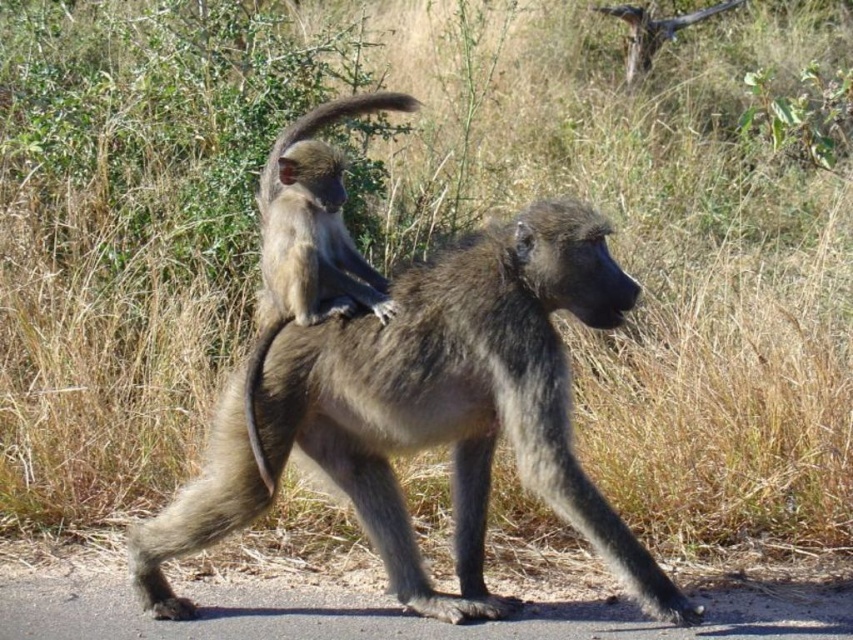
You are a wildlife photographer observing the two gray furry monkeys in the image. You want to capture a photo where the gray furry monkey at center is visible behind the gray furry monkey at upper center. Is this possible based on their positions?

Yes, the gray furry monkey at center is located below the gray furry monkey at upper center, so positioning the camera to include both would allow the lower monkey to be seen behind the upper one.

You are observing two animals in a savanna. You see a gray furry monkey at upper center and a fuzzy gray tail at center. Which animal is positioned to the right of the other?

The gray furry monkey at upper center is positioned to the right of the fuzzy gray tail at center.